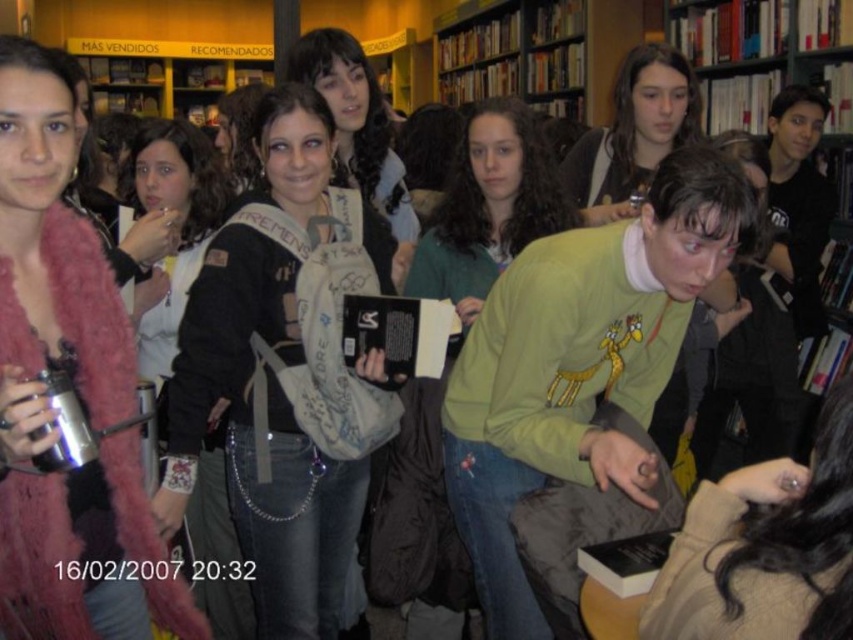
Question: Is fuzzy pink coat at upper left above white textured backpack at center?

Choices:
 (A) yes
 (B) no

Answer: (A)

Question: Considering the relative positions of white textured backpack at center and light brown sweater at lower right in the image provided, where is white textured backpack at center located with respect to light brown sweater at lower right?

Choices:
 (A) above
 (B) below

Answer: (A)

Question: Does green matte sweater at center appear over black leather jacket at center?

Choices:
 (A) no
 (B) yes

Answer: (A)

Question: Based on their relative distances, which object is farther from the light brown sweater at lower right?

Choices:
 (A) fuzzy pink coat at upper left
 (B) green matte sweater at center

Answer: (A)

Question: Which of the following is the farthest from the observer?

Choices:
 (A) (264, 444)
 (B) (490, 269)

Answer: (B)

Question: Among these points, which one is farthest from the camera?

Choices:
 (A) [x=166, y=353]
 (B) [x=283, y=109]
 (C) [x=749, y=554]
 (D) [x=523, y=246]

Answer: (A)